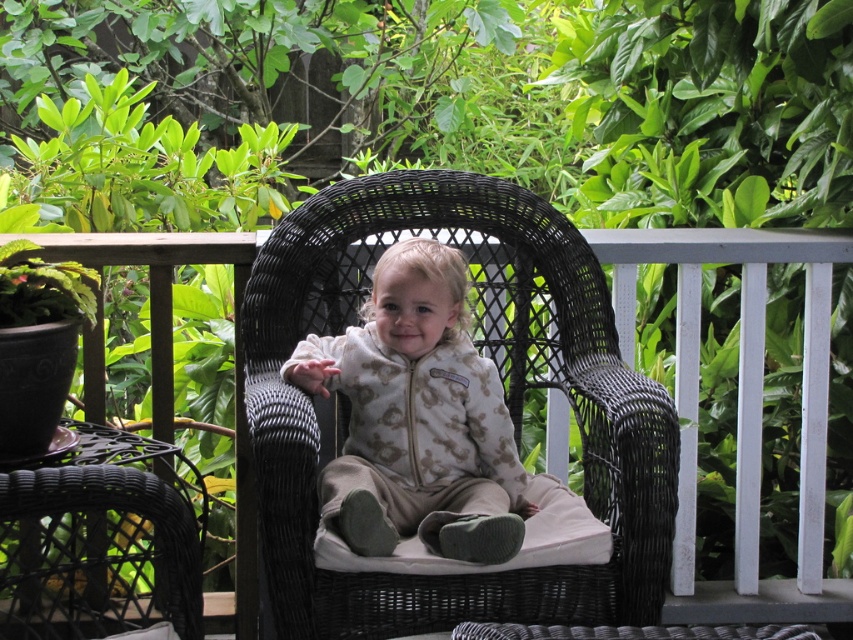
You are a parent trying to arrange two black wicker chairs for your child on a balcony. The chairs are labeled as the black wicker armchair at center and the black wicker chair at center. According to the image, which chair is positioned to the left?

The black wicker armchair at center is to the left of the black wicker chair at center.

You are standing in front of a balcony with a black wicker armchair at center. If you want to sit down, will you be able to reach the chair without moving your feet?

The black wicker armchair at center is 2.72 meters away from the viewer, so you would need to move your feet to reach it since it is too far to sit without moving.

You are a parent trying to choose between placing a 1.2m tall potted plant between the black wicker armchair at center and the black wicker chair at center. Which chair should you place it next to if you want the plant to be taller than the chair?

The black wicker armchair at center is not as tall as the black wicker chair at center, so placing the potted plant next to the black wicker chair at center would ensure the plant is taller than the chair.